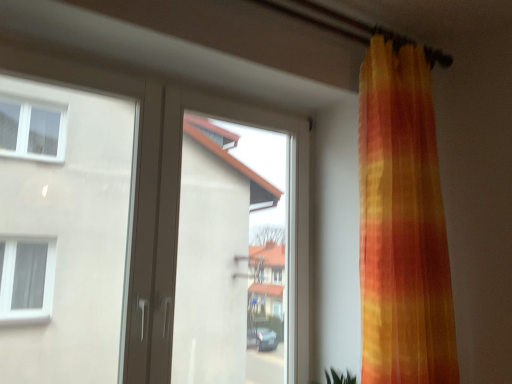
Question: Is transparent glass window at center at the back of matte brown door at left?

Choices:
 (A) no
 (B) yes

Answer: (B)

Question: Does matte brown door at left have a greater height compared to transparent glass window at center?

Choices:
 (A) no
 (B) yes

Answer: (B)

Question: From the image's perspective, is matte brown door at left below transparent glass window at center?

Choices:
 (A) no
 (B) yes

Answer: (A)

Question: Is matte brown door at left positioned beyond the bounds of transparent glass window at center?

Choices:
 (A) yes
 (B) no

Answer: (B)

Question: Is matte brown door at left touching transparent glass window at center?

Choices:
 (A) no
 (B) yes

Answer: (A)

Question: Can you confirm if matte brown door at left is positioned to the right of transparent glass window at center?

Choices:
 (A) no
 (B) yes

Answer: (A)

Question: Are transparent glass window at center and matte brown door at left located far from each other?

Choices:
 (A) yes
 (B) no

Answer: (A)

Question: Considering the relative sizes of transparent glass window at center and matte brown door at left in the image provided, is transparent glass window at center bigger than matte brown door at left?

Choices:
 (A) no
 (B) yes

Answer: (B)

Question: Considering the relative positions of transparent glass window at center and matte brown door at left in the image provided, is transparent glass window at center to the right of matte brown door at left from the viewer's perspective?

Choices:
 (A) yes
 (B) no

Answer: (A)

Question: Is transparent glass window at center taller than matte brown door at left?

Choices:
 (A) yes
 (B) no

Answer: (B)

Question: Is transparent glass window at center at the left side of matte brown door at left?

Choices:
 (A) yes
 (B) no

Answer: (B)

Question: Can you see transparent glass window at center touching matte brown door at left?

Choices:
 (A) no
 (B) yes

Answer: (A)

Question: Based on their positions, is matte brown door at left located to the left or right of transparent glass window at center?

Choices:
 (A) right
 (B) left

Answer: (B)